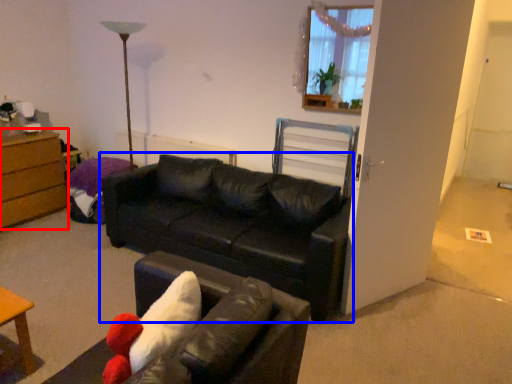
Question: Which object is closer to the camera taking this photo, chest of drawers (highlighted by a red box) or studio couch (highlighted by a blue box)?

Choices:
 (A) chest of drawers
 (B) studio couch

Answer: (B)